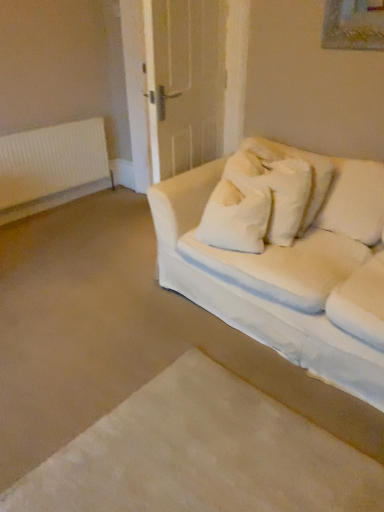
The width and height of the screenshot is (384, 512). I want to click on white plastic radiator at left, so click(x=51, y=167).

The image size is (384, 512). What do you see at coordinates (51, 167) in the screenshot?
I see `white plastic radiator at left` at bounding box center [51, 167].

Locate an element on the screen. The height and width of the screenshot is (512, 384). white soft carpet at lower left is located at coordinates (201, 455).

In the scene shown: How different are the orientations of white soft carpet at lower left and white fabric couch at right in degrees?

179 degrees.

In the scene shown: Considering the sizes of white soft carpet at lower left and white fabric couch at right in the image, is white soft carpet at lower left bigger or smaller than white fabric couch at right?

white soft carpet at lower left is smaller than white fabric couch at right.

Is white soft carpet at lower left facing towards white fabric couch at right?

Yes, white soft carpet at lower left is facing white fabric couch at right.

Would you say white soft carpet at lower left is to the left or to the right of white fabric couch at right in the picture?

In the image, white soft carpet at lower left appears on the left side of white fabric couch at right.

Is white plastic radiator at left not near white fabric couch at right?

Yes, white plastic radiator at left and white fabric couch at right are located far from each other.

At what (x,y) coordinates should I click in order to perform the action: click on radiator located underneath the white fabric couch at right (from a real-world perspective). Please return your answer as a coordinate pair (x, y). Image resolution: width=384 pixels, height=512 pixels. Looking at the image, I should click on (51, 167).

Is white plastic radiator at left at the right side of white fabric couch at right?

No, white plastic radiator at left is not to the right of white fabric couch at right.

Considering the points (70, 200) and (228, 177), which point is behind, point (70, 200) or point (228, 177)?

Point (70, 200)

Is white plastic radiator at left smaller than white soft carpet at lower left?

Indeed, white plastic radiator at left has a smaller size compared to white soft carpet at lower left.

Which object is closer to the camera taking this photo, white plastic radiator at left or white soft carpet at lower left?

white soft carpet at lower left is closer to the camera.

From the image's perspective, is white plastic radiator at left located beneath white soft carpet at lower left?

No, from the image's perspective, white plastic radiator at left is not beneath white soft carpet at lower left.

Between white soft carpet at lower left and white plastic radiator at left, which one has smaller width?

Thinner between the two is white plastic radiator at left.

From a real-world perspective, is white soft carpet at lower left positioned under white plastic radiator at left based on gravity?

Yes, from a real-world perspective, white soft carpet at lower left is under white plastic radiator at left.

Based on the photo, is white soft carpet at lower left situated inside white plastic radiator at left or outside?

white soft carpet at lower left lies outside white plastic radiator at left.

Is white soft carpet at lower left at the left side of white plastic radiator at left?

No.

Is white fabric couch at right smaller than white soft carpet at lower left?

No.

The height and width of the screenshot is (512, 384). What are the coordinates of `studio couch on the right of white soft carpet at lower left` in the screenshot? It's located at (289, 262).

Measure the distance between white fabric couch at right and white soft carpet at lower left.

white fabric couch at right is 27.94 inches away from white soft carpet at lower left.

From the image's perspective, which one is positioned lower, white fabric couch at right or white plastic radiator at left?

white fabric couch at right, from the image's perspective.

Where is `radiator behind the white fabric couch at right`? radiator behind the white fabric couch at right is located at coordinates (51, 167).

Considering the relative sizes of white fabric couch at right and white plastic radiator at left in the image provided, is white fabric couch at right bigger than white plastic radiator at left?

Indeed, white fabric couch at right has a larger size compared to white plastic radiator at left.

How different are the orientations of white fabric couch at right and white plastic radiator at left in degrees?

The angle between the facing direction of white fabric couch at right and the facing direction of white plastic radiator at left is 89.5 degrees.

The image size is (384, 512). I want to click on bed frame that appears below the white fabric couch at right (from the image's perspective), so click(x=201, y=455).

Locate an element on the screen. The height and width of the screenshot is (512, 384). studio couch in front of the white plastic radiator at left is located at coordinates (289, 262).

Based on their spatial positions, is white soft carpet at lower left or white fabric couch at right further from white plastic radiator at left?

Based on the image, white soft carpet at lower left appears to be further to white plastic radiator at left.

Based on the photo, considering their positions, is white plastic radiator at left positioned closer to white soft carpet at lower left than white fabric couch at right?

The object closer to white soft carpet at lower left is white fabric couch at right.

Considering their positions, is white fabric couch at right positioned closer to white soft carpet at lower left than white plastic radiator at left?

white fabric couch at right lies closer to white soft carpet at lower left than the other object.

Estimate the real-world distances between objects in this image. Which object is further from white fabric couch at right, white soft carpet at lower left or white plastic radiator at left?

Among the two, white plastic radiator at left is located further to white fabric couch at right.

Which object lies further to the anchor point white plastic radiator at left, white fabric couch at right or white soft carpet at lower left?

white soft carpet at lower left is further to white plastic radiator at left.

Looking at the image, which one is located closer to white fabric couch at right, white plastic radiator at left or white soft carpet at lower left?

white soft carpet at lower left lies closer to white fabric couch at right than the other object.

At what (x,y) coordinates should I click in order to perform the action: click on studio couch positioned between white soft carpet at lower left and white plastic radiator at left from near to far. Please return your answer as a coordinate pair (x, y). The height and width of the screenshot is (512, 384). Looking at the image, I should click on (289, 262).